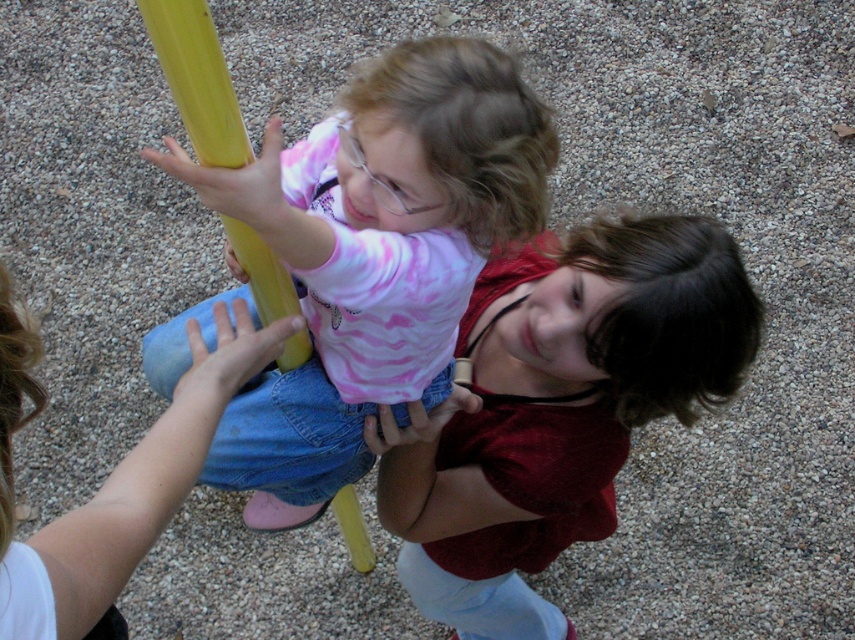
Does pink tie-dye shirt at center lie behind matte red shirt at center?

No, pink tie-dye shirt at center is in front of matte red shirt at center.

Which is in front, point (373, 248) or point (581, 312)?

Point (373, 248)

Is point (245, 467) in front of point (452, 582)?

Yes, point (245, 467) is closer to viewer.

Where is `pink tie-dye shirt at center`? pink tie-dye shirt at center is located at coordinates (375, 253).